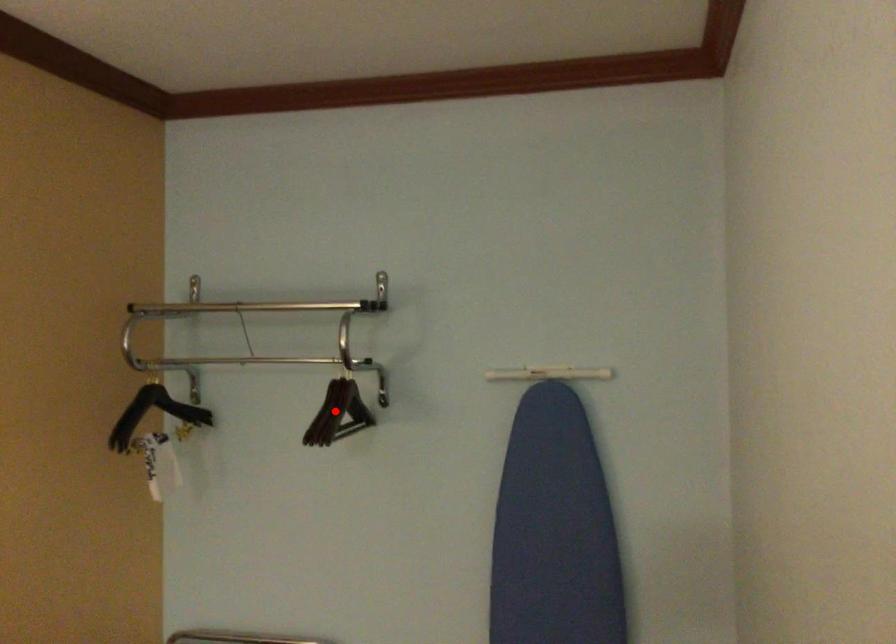
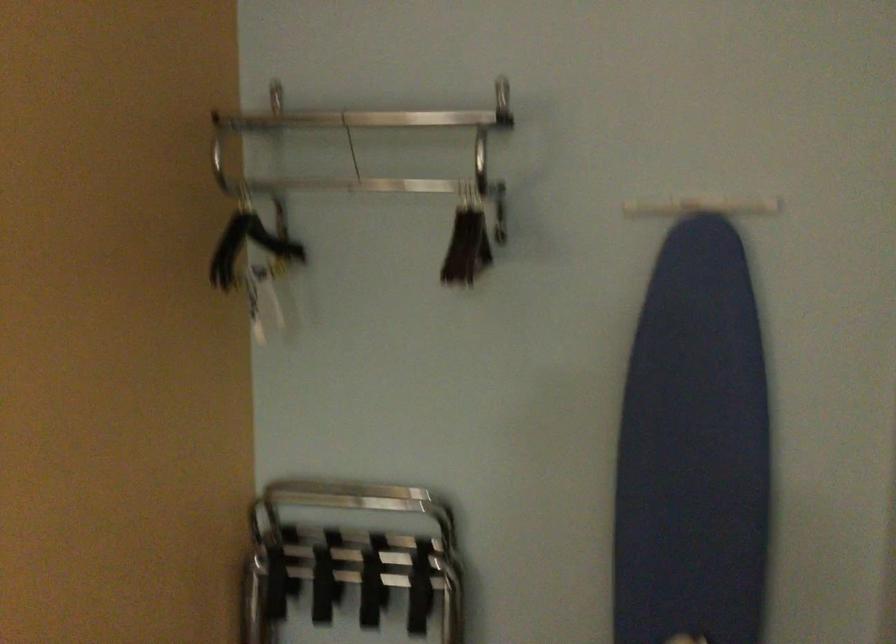
Locate, in the second image, the point that corresponds to the highlighted location in the first image.

(467, 245)